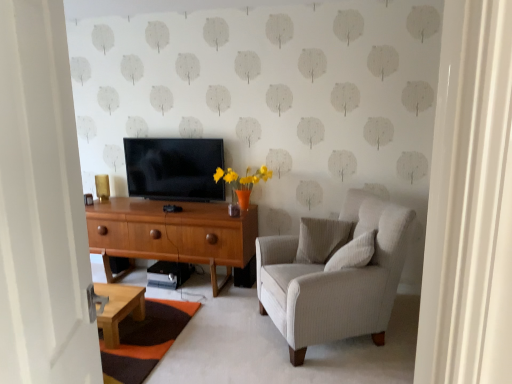
You are a GUI agent. You are given a task and a screenshot of the screen. Output one action in this format:
    pyautogui.click(x=<x>, y=<y>)
    Task: Click on the free space below flat screen tv at center (from a real-world perspective)
    The height and width of the screenshot is (384, 512).
    Given the screenshot: What is the action you would take?
    pyautogui.click(x=181, y=197)